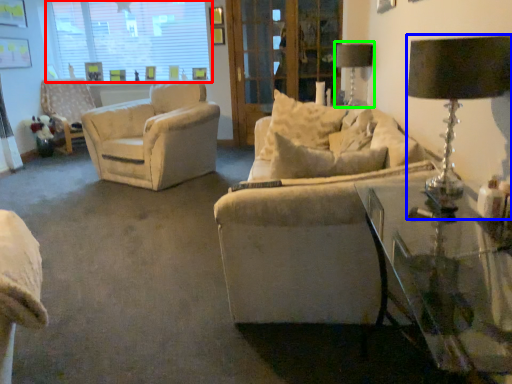
Question: Which object is the farthest from window (highlighted by a red box)? Choose among these: table lamp (highlighted by a blue box) or table lamp (highlighted by a green box).

Choices:
 (A) table lamp
 (B) table lamp

Answer: (A)